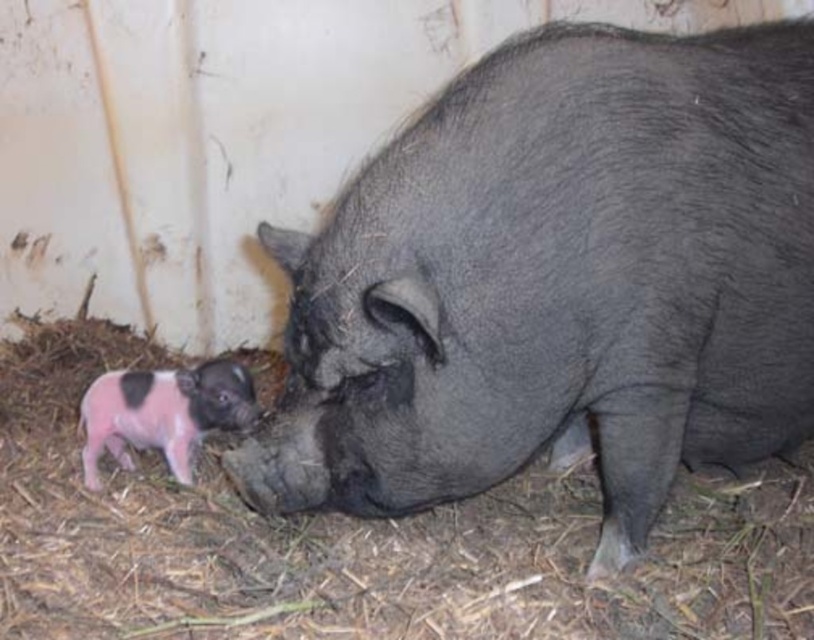
From the picture: Between shiny black pig at center and pink soft fur piglet at lower left, which one has more height?

shiny black pig at center

Does shiny black pig at center have a larger size compared to pink soft fur piglet at lower left?

Indeed, shiny black pig at center has a larger size compared to pink soft fur piglet at lower left.

You are a GUI agent. You are given a task and a screenshot of the screen. Output one action in this format:
    pyautogui.click(x=<x>, y=<y>)
    Task: Click on the shiny black pig at center
    
    Given the screenshot: What is the action you would take?
    click(558, 280)